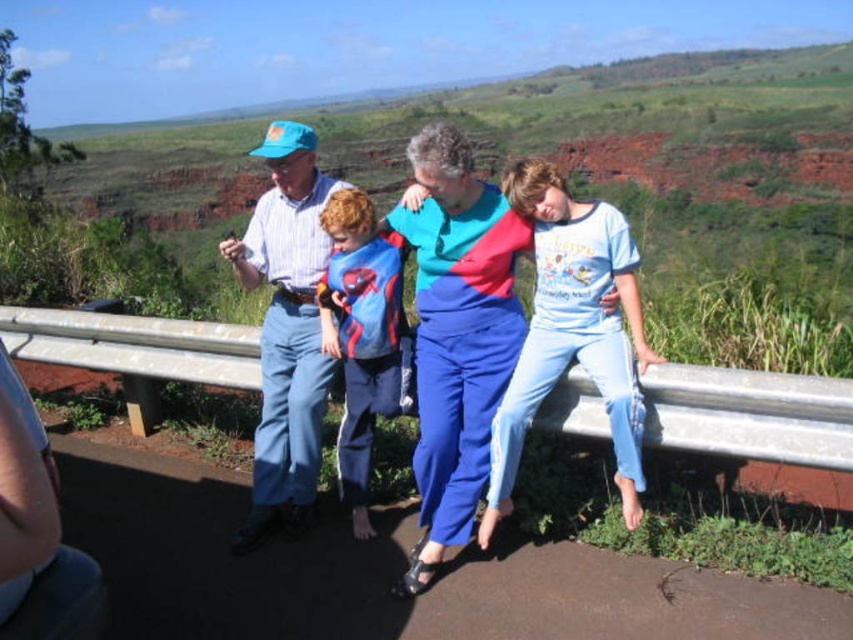
Who is taller, silver metallic rail at center or light blue cotton shirt at center?

silver metallic rail at center is taller.

Can you confirm if silver metallic rail at center is thinner than light blue cotton shirt at center?

No.

Is point (688, 381) positioned behind point (636, 324)?

No, it is not.

You are a GUI agent. You are given a task and a screenshot of the screen. Output one action in this format:
    pyautogui.click(x=<x>, y=<y>)
    Task: Click on the silver metallic rail at center
    The height and width of the screenshot is (640, 853).
    Given the screenshot: What is the action you would take?
    pyautogui.click(x=750, y=413)

Can you confirm if green grassy hillside at upper center is bigger than light blue cotton shirt at center?

Indeed, green grassy hillside at upper center has a larger size compared to light blue cotton shirt at center.

Which is more to the right, green grassy hillside at upper center or light blue cotton shirt at center?

light blue cotton shirt at center is more to the right.

Is point (639, 192) positioned before point (550, 387)?

No.

Where is `green grassy hillside at upper center`? The width and height of the screenshot is (853, 640). green grassy hillside at upper center is located at coordinates (677, 182).

Which is below, green grassy hillside at upper center or blue satin blouse at center?

blue satin blouse at center

Is green grassy hillside at upper center positioned behind blue satin blouse at center?

Yes, it is behind blue satin blouse at center.

At what (x,y) coordinates should I click in order to perform the action: click on green grassy hillside at upper center. Please return your answer as a coordinate pair (x, y). Looking at the image, I should click on (677, 182).